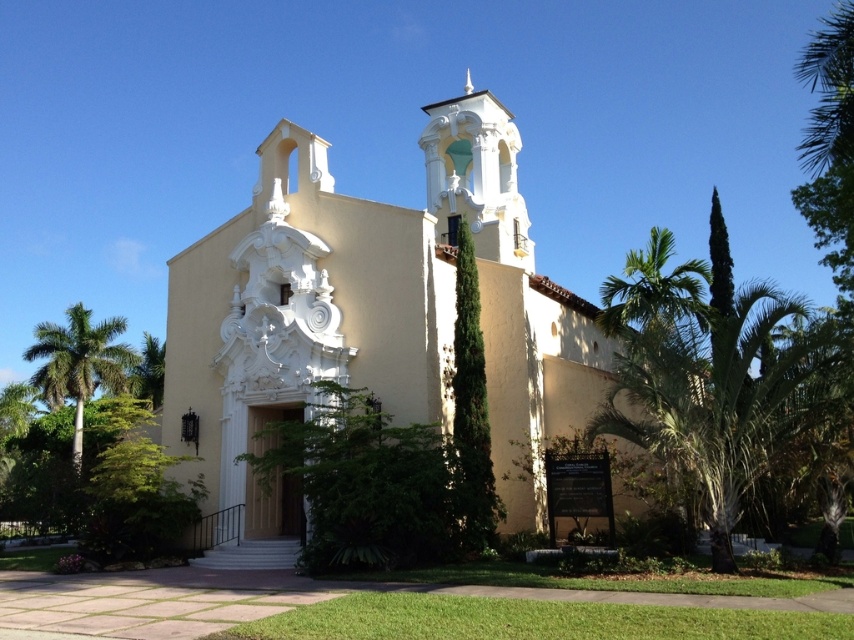
This screenshot has height=640, width=854. Find the location of `beige stucco church at center`. beige stucco church at center is located at coordinates (373, 314).

Is beige stucco church at center behind green leafy palm tree at left?

No, it is not.

Is point (196, 451) positioned behind point (114, 342)?

No, it is in front of (114, 342).

Locate an element on the screen. beige stucco church at center is located at coordinates (373, 314).

Is beige stucco church at center wider than white ornate bell tower at upper center?

Yes, beige stucco church at center is wider than white ornate bell tower at upper center.

The width and height of the screenshot is (854, 640). Describe the element at coordinates (373, 314) in the screenshot. I see `beige stucco church at center` at that location.

Which is behind, point (389, 346) or point (527, 237)?

Point (527, 237)

Find the location of `beige stucco church at center`. beige stucco church at center is located at coordinates (373, 314).

Which is behind, point (496, 243) or point (51, 360)?

The point (51, 360) is behind.

Does point (524, 237) lie in front of point (51, 376)?

Yes, it is in front of point (51, 376).

You are a GUI agent. You are given a task and a screenshot of the screen. Output one action in this format:
    pyautogui.click(x=<x>, y=<y>)
    Task: Click on the white ornate bell tower at upper center
    
    Given the screenshot: What is the action you would take?
    pyautogui.click(x=477, y=173)